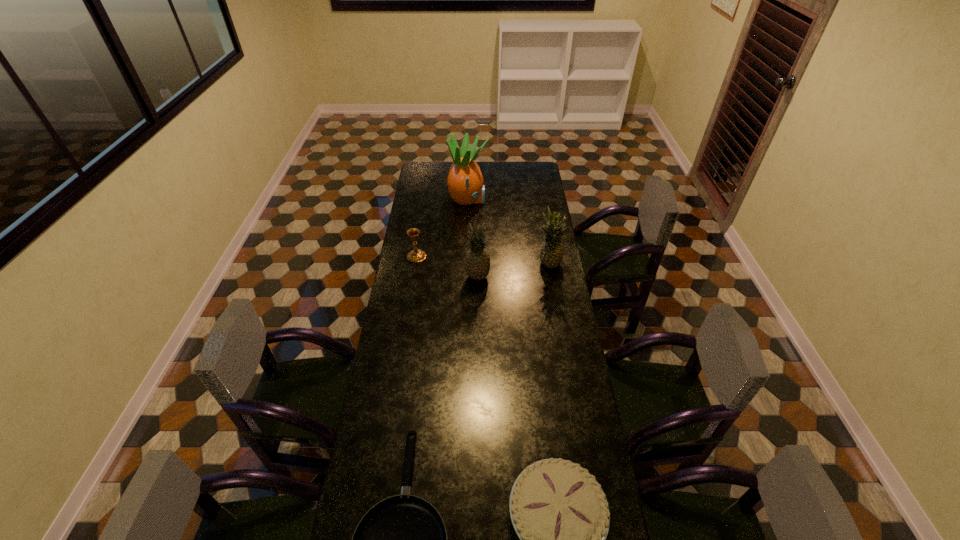
Where is `the farthest object`? The image size is (960, 540). the farthest object is located at coordinates (465, 183).

Where is `the tallest object`? The height and width of the screenshot is (540, 960). the tallest object is located at coordinates (465, 183).

This screenshot has height=540, width=960. Find the location of `the rightmost pineapple`. the rightmost pineapple is located at coordinates (551, 254).

Find the location of a particular element. This screenshot has width=960, height=540. the third shortest object is located at coordinates (416, 255).

In order to click on vacant region located at the entrance of the farthest object in this screenshot , I will do `click(507, 200)`.

At what (x,y) coordinates should I click in order to perform the action: click on free space located 0.270m on the back of the rightmost pineapple. Please return your answer as a coordinate pair (x, y). The image size is (960, 540). Looking at the image, I should click on (542, 222).

The image size is (960, 540). Find the location of `vacant space situated 0.380m on the front of the third shortest object`. vacant space situated 0.380m on the front of the third shortest object is located at coordinates (406, 323).

Identify the location of object at the left edge. This screenshot has width=960, height=540. (416, 255).

At what (x,y) coordinates should I click in order to perform the action: click on object that is at the right edge. Please return your answer as a coordinate pair (x, y). The image size is (960, 540). Looking at the image, I should click on (551, 254).

The width and height of the screenshot is (960, 540). Identify the location of vacant space at the far edge. (507, 178).